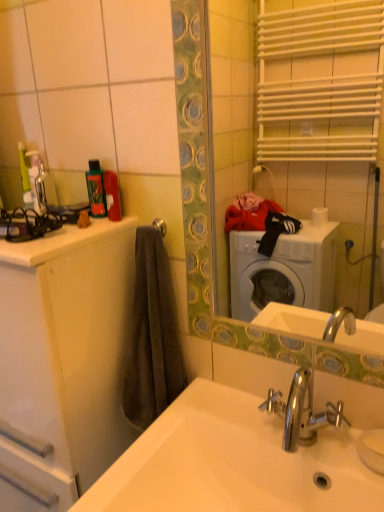
Identify the location of free space above white glossy cabinet at left (from a real-world perspective). The height and width of the screenshot is (512, 384). (33, 231).